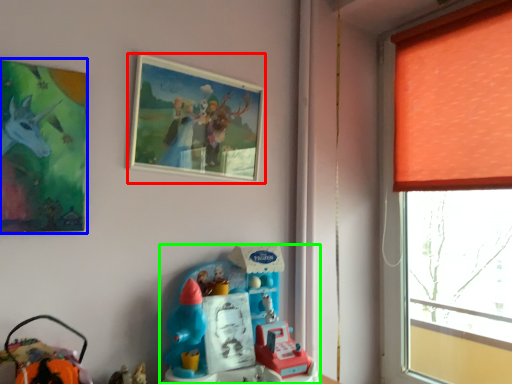
Question: Which object is positioned closest to picture frame (highlighted by a red box)? Select from picture frame (highlighted by a blue box) and toy (highlighted by a green box).

Choices:
 (A) picture frame
 (B) toy

Answer: (A)